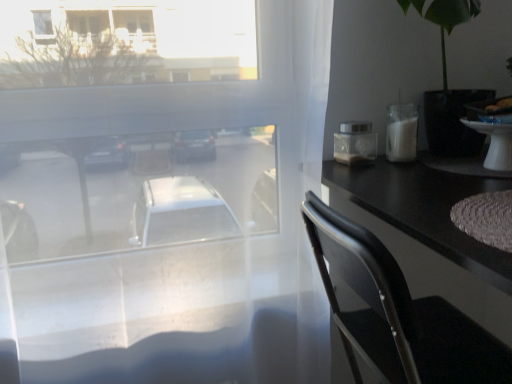
Find the location of a particular element. Image resolution: width=512 pixels, height=384 pixels. vacant space behind white glossy table at right is located at coordinates (451, 156).